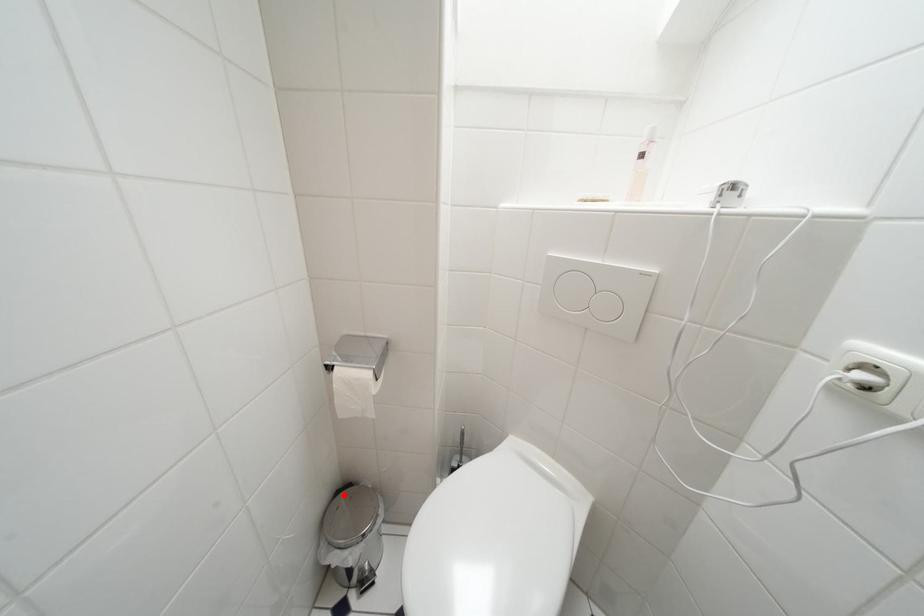
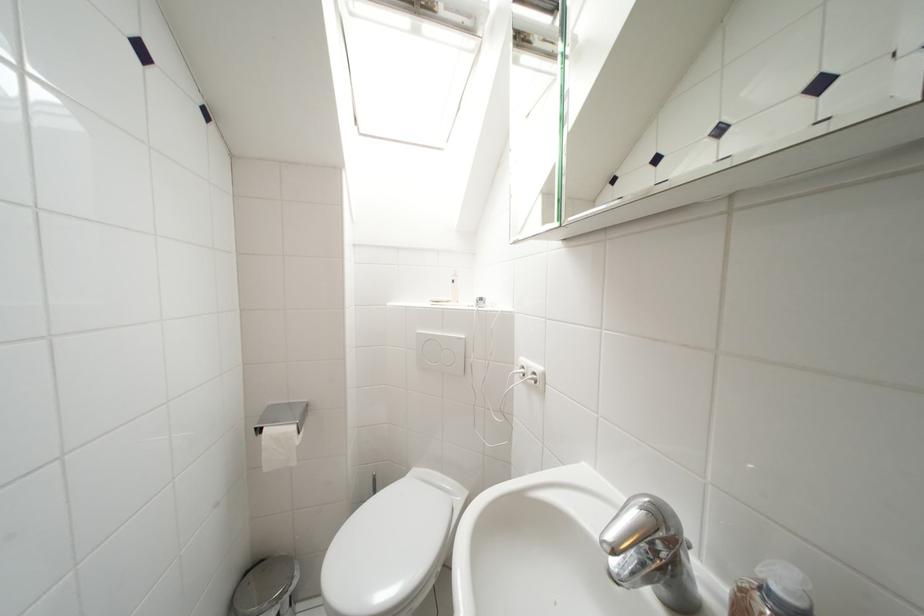
Find the pixel in the second image that matches the highlighted location in the first image.

(253, 577)